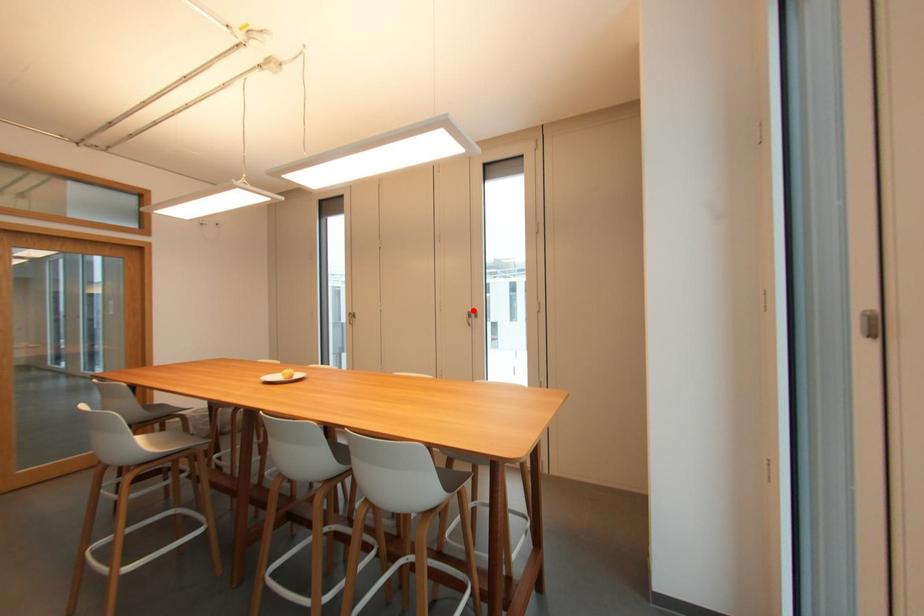
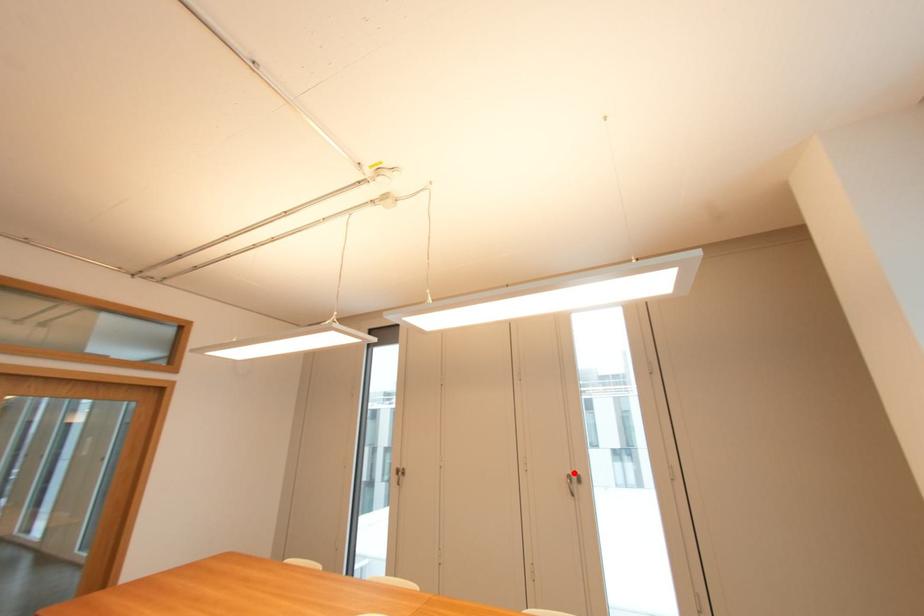
I am providing you with two images of the same scene from different viewpoints. A red point is marked on the first image and another point is marked on the second image. Is the marked point in image1 the same physical position as the marked point in image2?

Yes